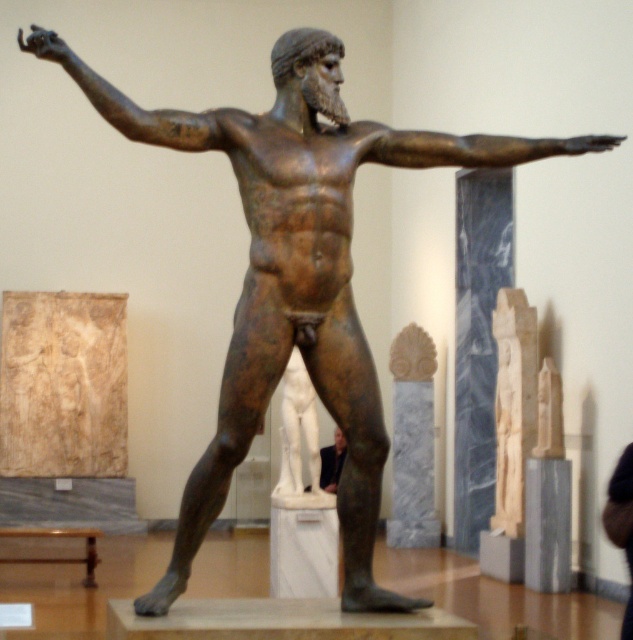
You are a museum visitor standing in front of the statue. You notice two items in the scene. One is the bronze arm at upper left and the other is the dark suit at center. Which of these two items is positioned to the left of the other?

The bronze arm at upper left is positioned to the left of the dark suit at center.

You are a curator planning to install a new light at point (467, 147). What object will the light illuminate?

The light at point (467, 147) will illuminate the bronze muscular arm at center.

You are a visitor in the museum and want to take a photo of the bronze arm at upper left and the dark suit at center. Which object should you focus on first if you want to capture both in the same frame without moving the camera?

The bronze arm at upper left is located above the dark suit at center, so you should focus on the bronze arm at upper left first to ensure both are in the frame.